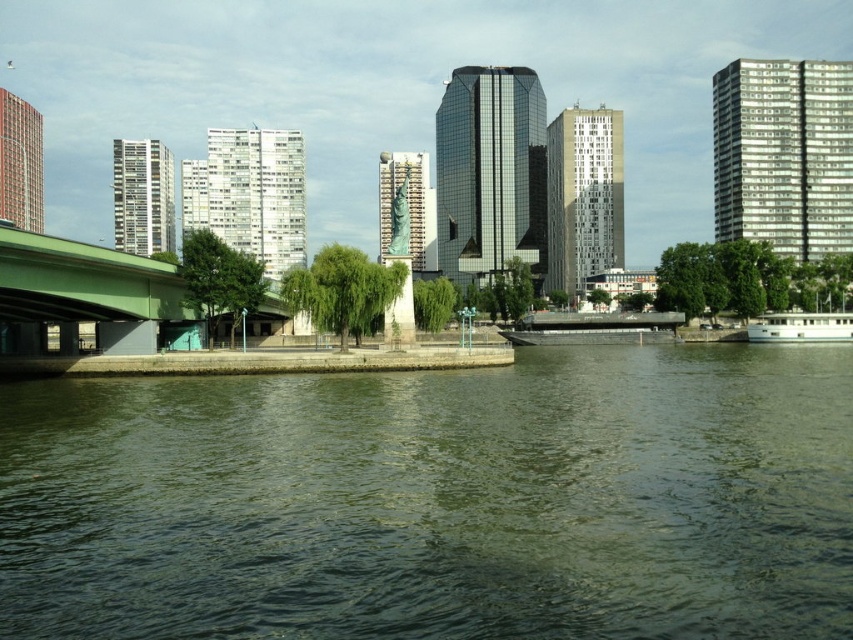
Is glossy glass skyscraper at center wider than dark gray metallic barge at center?

Indeed, glossy glass skyscraper at center has a greater width compared to dark gray metallic barge at center.

Can you confirm if glossy glass skyscraper at center is smaller than dark gray metallic barge at center?

No.

Which is behind, point (514, 88) or point (560, 339)?

Positioned behind is point (514, 88).

In order to click on glossy glass skyscraper at center in this screenshot , I will do `click(491, 173)`.

Which is more to the left, glossy glass skyscraper at center or red brick building at upper left?

Positioned to the left is red brick building at upper left.

Can you confirm if glossy glass skyscraper at center is thinner than red brick building at upper left?

No, glossy glass skyscraper at center is not thinner than red brick building at upper left.

Where is `glossy glass skyscraper at center`? glossy glass skyscraper at center is located at coordinates (491, 173).

What are the coordinates of `glossy glass skyscraper at center` in the screenshot? It's located at (491, 173).

Consider the image. Who is more distant from viewer, (164, 316) or (223, 138)?

The point (223, 138) is more distant.

Does green concrete bridge at left have a greater width compared to white smooth building at center?

In fact, green concrete bridge at left might be narrower than white smooth building at center.

The image size is (853, 640). What are the coordinates of `green concrete bridge at left` in the screenshot? It's located at pyautogui.click(x=86, y=294).

Locate an element on the screen. This screenshot has width=853, height=640. green concrete bridge at left is located at coordinates (86, 294).